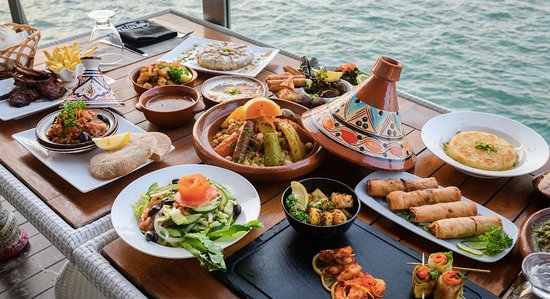
The height and width of the screenshot is (299, 550). Find the location of `serving board`. serving board is located at coordinates (x=305, y=269).